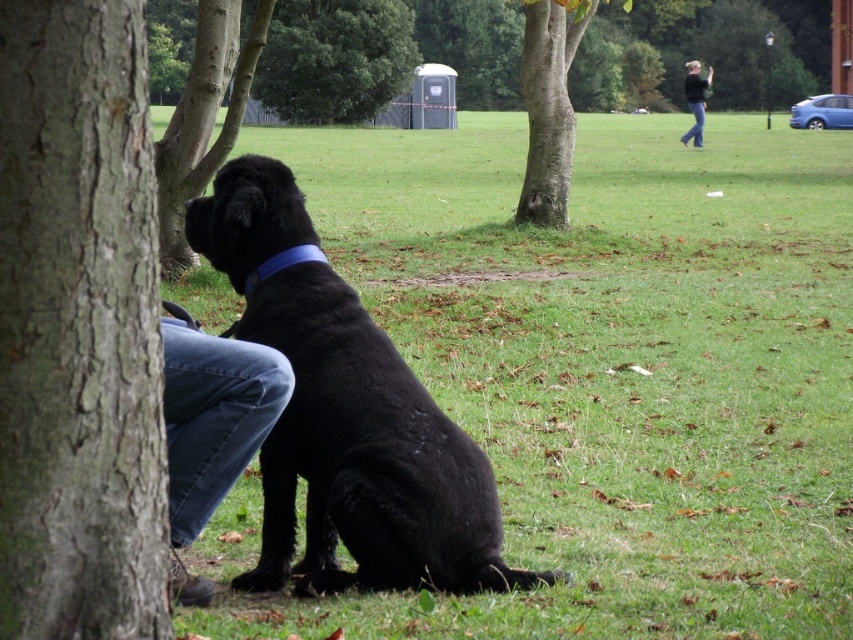
Between jeans at lower left and blue matte neckband at center, which one is positioned higher?

blue matte neckband at center is above.

Is point (241, 451) behind point (311, 246)?

No, (241, 451) is in front of (311, 246).

You are a GUI agent. You are given a task and a screenshot of the screen. Output one action in this format:
    pyautogui.click(x=<x>, y=<y>)
    Task: Click on the jeans at lower left
    The width and height of the screenshot is (853, 640).
    Given the screenshot: What is the action you would take?
    pyautogui.click(x=212, y=428)

Which of these two, brown rough tree trunk at left or blue matte neckband at center, stands shorter?

blue matte neckband at center

Who is taller, brown rough tree trunk at left or blue matte neckband at center?

brown rough tree trunk at left

Between point (178, 145) and point (265, 268), which one is positioned in front?

Positioned in front is point (265, 268).

Where is `brown rough tree trunk at left`? This screenshot has height=640, width=853. brown rough tree trunk at left is located at coordinates (204, 120).

Does jeans at lower left appear under smooth bark tree at center?

Correct, jeans at lower left is located below smooth bark tree at center.

Between jeans at lower left and smooth bark tree at center, which one has more height?

With more height is smooth bark tree at center.

Does point (161, 333) come behind point (555, 208)?

That is False.

You are a GUI agent. You are given a task and a screenshot of the screen. Output one action in this format:
    pyautogui.click(x=<x>, y=<y>)
    Task: Click on the jeans at lower left
    The width and height of the screenshot is (853, 640).
    Given the screenshot: What is the action you would take?
    pyautogui.click(x=212, y=428)